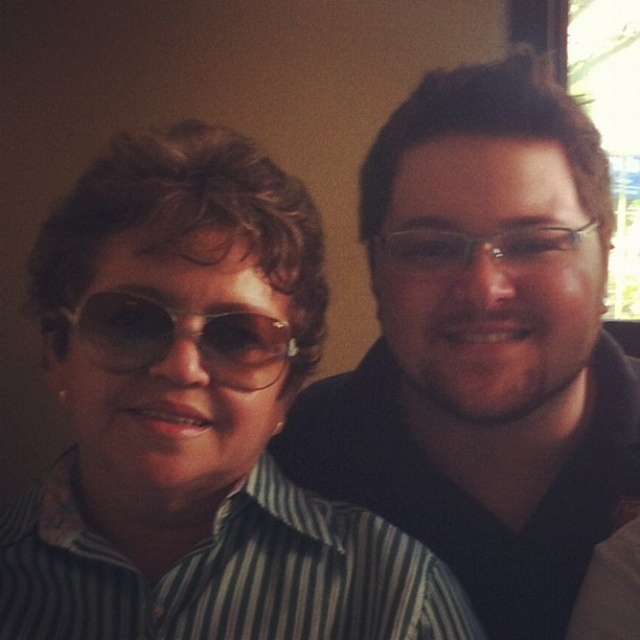
Question: Can you confirm if matte black sunglasses at upper left is positioned to the right of sunglasses at left?

Choices:
 (A) no
 (B) yes

Answer: (A)

Question: Can you confirm if matte black sunglasses at upper left is positioned below sunglasses at left?

Choices:
 (A) no
 (B) yes

Answer: (B)

Question: Which object appears closest to the camera in this image?

Choices:
 (A) matte black sunglasses at upper left
 (B) clear plastic glasses at center

Answer: (A)

Question: Among these objects, which one is nearest to the camera?

Choices:
 (A) clear plastic glasses at center
 (B) matte black shirt at right
 (C) sunglasses at left
 (D) matte black sunglasses at upper left

Answer: (D)

Question: Can you confirm if matte black sunglasses at upper left is wider than matte black shirt at right?

Choices:
 (A) yes
 (B) no

Answer: (B)

Question: Which of the following is the farthest from the observer?

Choices:
 (A) matte black shirt at right
 (B) sunglasses at left
 (C) matte black sunglasses at upper left
 (D) clear plastic glasses at center

Answer: (D)